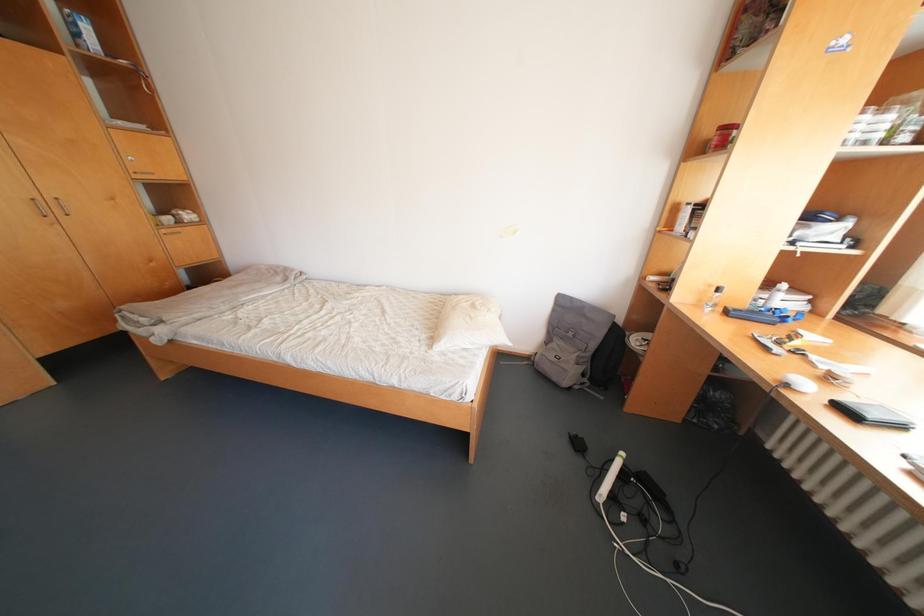
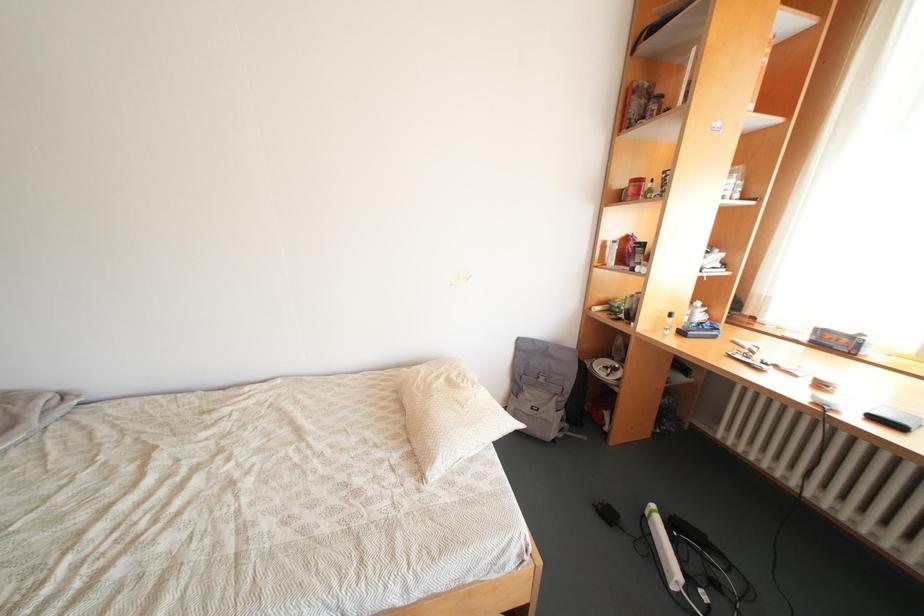
Which direction would the cameraman need to move to produce the second image?

The cameraman moved toward left, forward.